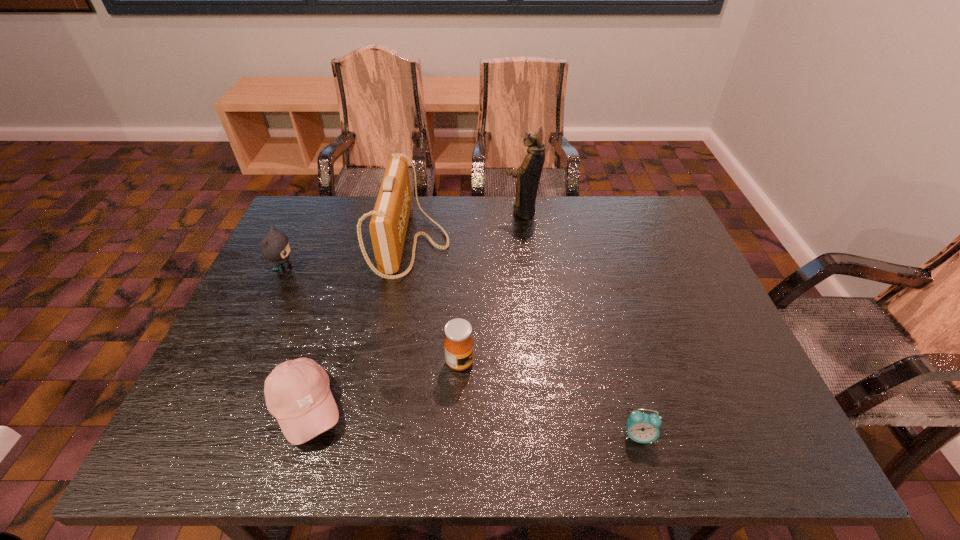
Find the location of a particular element. The height and width of the screenshot is (540, 960). the tallest object is located at coordinates (528, 175).

Where is `figurine`? The height and width of the screenshot is (540, 960). figurine is located at coordinates (528, 175).

Image resolution: width=960 pixels, height=540 pixels. Identify the location of handbag. (388, 225).

This screenshot has width=960, height=540. I want to click on kitten, so click(x=275, y=246).

Find the location of a particular element. The image size is (960, 540). honey is located at coordinates (458, 344).

Find the location of `the second shortest object`. the second shortest object is located at coordinates 297,392.

You are a GUI agent. You are given a task and a screenshot of the screen. Output one action in this format:
    pyautogui.click(x=<x>, y=<y>)
    Task: Click on the alarm clock
    The width and height of the screenshot is (960, 540).
    Given the screenshot: What is the action you would take?
    pyautogui.click(x=643, y=428)

Locate an element on the screen. the shortest object is located at coordinates (643, 428).

I want to click on free space located on the front-facing side of the fifth object from left to right, so click(384, 211).

Find the location of a particular element. vacant region located on the front-facing side of the fifth object from left to right is located at coordinates (381, 211).